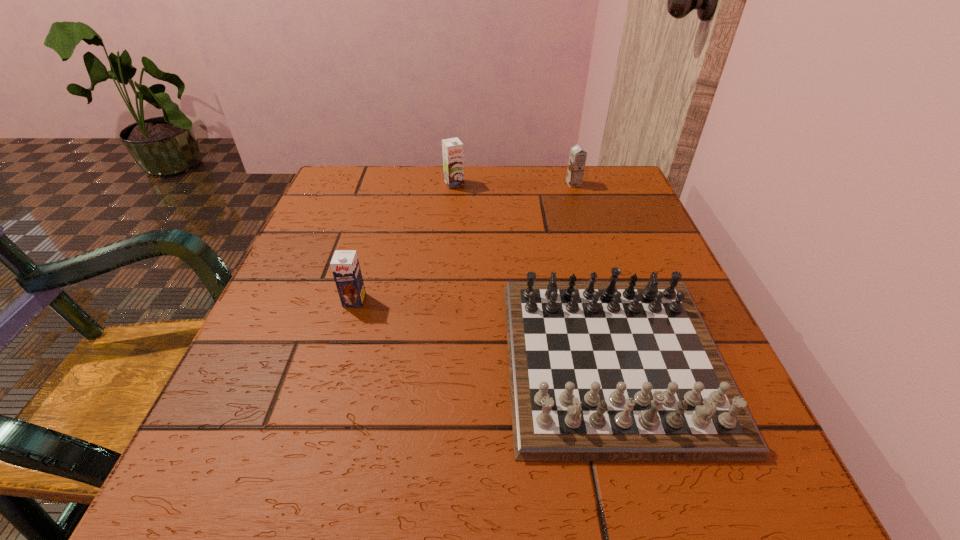
Locate an element on the screen. The height and width of the screenshot is (540, 960). chocolate milk that can be found as the third closest to the chessboard is located at coordinates (453, 162).

Choose which chocolate milk is the nearest neighbor to the leftmost object. Please provide its 2D coordinates. Your answer should be formatted as a tuple, i.e. [(x, y)], where the tuple contains the x and y coordinates of a point satisfying the conditions above.

[(453, 162)]